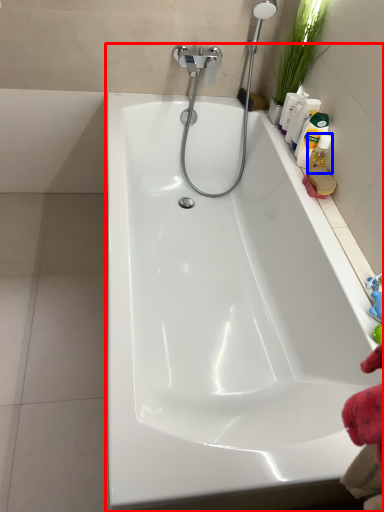
Question: Which object is further to the camera taking this photo, bathtub (highlighted by a red box) or cleaning product (highlighted by a blue box)?

Choices:
 (A) bathtub
 (B) cleaning product

Answer: (B)